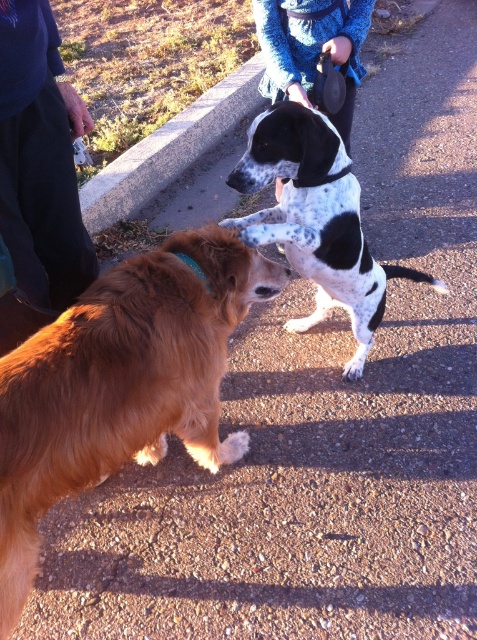
Describe the element at coordinates (121, 384) in the screenshot. I see `golden brown fur at center` at that location.

Does golden brown fur at center appear on the left side of spotted fur dog at center?

Yes, golden brown fur at center is to the left of spotted fur dog at center.

This screenshot has width=477, height=640. What are the coordinates of `golden brown fur at center` in the screenshot? It's located at (121, 384).

Locate an element on the screen. golden brown fur at center is located at coordinates (121, 384).

Is the position of golden brown fur at center less distant than that of blue knitted sweater at upper center?

Yes, it is.

Where is `golden brown fur at center`? golden brown fur at center is located at coordinates (121, 384).

Is golden brown fur at center bigger than blue denim pants at lower left?

Yes, golden brown fur at center is bigger than blue denim pants at lower left.

Is golden brown fur at center below blue denim pants at lower left?

Indeed, golden brown fur at center is positioned under blue denim pants at lower left.

Image resolution: width=477 pixels, height=640 pixels. I want to click on golden brown fur at center, so click(x=121, y=384).

Where is `golden brown fur at center`? golden brown fur at center is located at coordinates (121, 384).